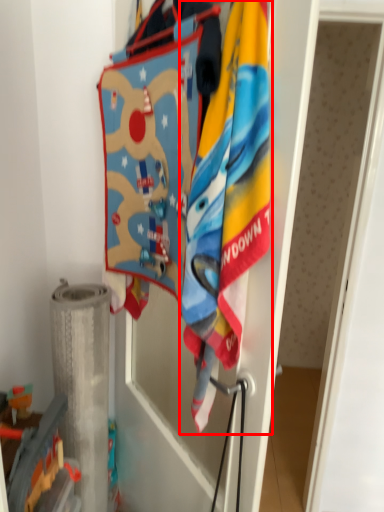
Question: In this image, where is towel (annotated by the red box) located relative to toy?

Choices:
 (A) left
 (B) right

Answer: (B)